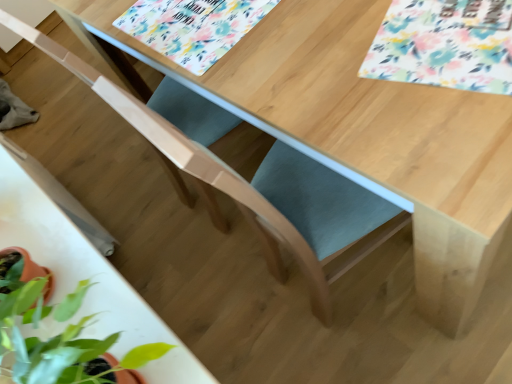
Question: In terms of size, does floral-patterned placemat at upper center, which appears as the first flower when viewed from the back, appear bigger or smaller than floral-patterned paper at upper right, positioned as the first flower in front-to-back order?

Choices:
 (A) big
 (B) small

Answer: (A)

Question: Is floral-patterned placemat at upper center, which appears as the 2th flower when viewed from the right, spatially inside floral-patterned paper at upper right, the first flower from the right, or outside of it?

Choices:
 (A) inside
 (B) outside

Answer: (B)

Question: Estimate the real-world distances between objects in this image. Which object is closer to the floral-patterned paper at upper right, the 2th flower positioned from the left?

Choices:
 (A) white glossy round table at center
 (B) floral-patterned placemat at upper center, which appears as the 2th flower when viewed from the right

Answer: (B)

Question: Which of these objects is positioned closest to the floral-patterned placemat at upper center, which appears as the first flower when viewed from the back?

Choices:
 (A) floral-patterned paper at upper right, the first flower from the right
 (B) white glossy round table at center

Answer: (A)